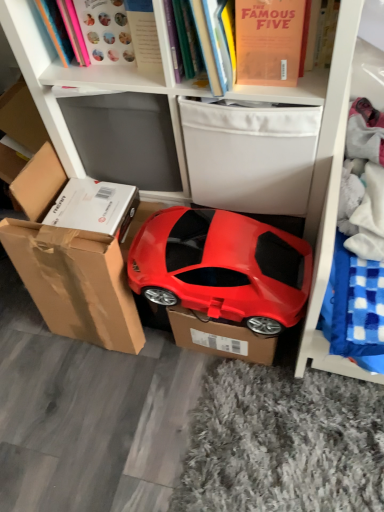
What do you see at coordinates (56, 29) in the screenshot? This screenshot has width=384, height=512. I see `matte pink book at upper left, which appears as the third book when viewed from the right` at bounding box center [56, 29].

In order to face matte pink book at upper left, the 1th book when ordered from left to right, should I rotate leftwards or rightwards?

Rotate left and turn 17.735 degrees.

In order to click on brown cardboard box at lower left in this screenshot , I will do `click(70, 265)`.

Describe the element at coordinates (102, 31) in the screenshot. Image resolution: width=384 pixels, height=512 pixels. I see `hardcover book at upper center, the 2th book in the left-to-right sequence` at that location.

This screenshot has width=384, height=512. In order to click on matte pink book at upper left, the 1th book when ordered from left to right in this screenshot , I will do `click(56, 29)`.

Which of these two, matte pink book at upper left, the 1th book when ordered from left to right, or hardcover book at upper center, which is the second book in right-to-left order, is wider?

Wider between the two is hardcover book at upper center, which is the second book in right-to-left order.

Does matte pink book at upper left, the 1th book when ordered from left to right, appear on the right side of hardcover book at upper center, which is the second book in right-to-left order?

No, matte pink book at upper left, the 1th book when ordered from left to right, is not to the right of hardcover book at upper center, which is the second book in right-to-left order.

Is matte pink book at upper left, the 1th book when ordered from left to right, in front of or behind hardcover book at upper center, the 2th book in the left-to-right sequence, in the image?

Visually, matte pink book at upper left, the 1th book when ordered from left to right, is located behind hardcover book at upper center, the 2th book in the left-to-right sequence.

Is matte pink book at upper left, which appears as the third book when viewed from the right, turned away from hardcover book at upper center, the 2th book in the left-to-right sequence?

No.

Is point (46, 14) closer to camera compared to point (102, 247)?

No, (46, 14) is behind (102, 247).

Does hardcover book at upper center, which is the second book in right-to-left order, turn towards brown cardboard box at lower left?

No, hardcover book at upper center, which is the second book in right-to-left order, is not aimed at brown cardboard box at lower left.

Consider the image. Which of these two, hardcover book at upper center, which is the second book in right-to-left order, or brown cardboard box at lower left, is thinner?

Thinner between the two is brown cardboard box at lower left.

Measure the distance from hardcover book at upper center, the 2th book in the left-to-right sequence, to brown cardboard box at lower left.

hardcover book at upper center, the 2th book in the left-to-right sequence, is 20.40 inches away from brown cardboard box at lower left.

From the image's perspective, which book is the 3rd one above the glossy plastic car at center? Please provide its 2D coordinates.

[(56, 29)]

Does glossy plastic car at center appear on the left side of matte pink book at upper left, which appears as the third book when viewed from the right?

In fact, glossy plastic car at center is to the right of matte pink book at upper left, which appears as the third book when viewed from the right.

Does glossy plastic car at center come behind matte pink book at upper left, which appears as the third book when viewed from the right?

That is True.

From a real-world perspective, is white fabric storage box at upper center positioned over glossy plastic car at center based on gravity?

Yes, from a real-world perspective, white fabric storage box at upper center is on top of glossy plastic car at center.

Looking at this image, is white fabric storage box at upper center closer to camera compared to glossy plastic car at center?

No, the depth of white fabric storage box at upper center is greater than that of glossy plastic car at center.

Is white fabric storage box at upper center spatially inside glossy plastic car at center, or outside of it?

white fabric storage box at upper center lies outside glossy plastic car at center.

What's the angular difference between matte pink book at upper left, which appears as the third book when viewed from the right, and white fabric storage box at upper center's facing directions?

matte pink book at upper left, which appears as the third book when viewed from the right, and white fabric storage box at upper center are facing 6.11 degrees away from each other.

Considering the sizes of matte pink book at upper left, which appears as the third book when viewed from the right, and white fabric storage box at upper center in the image, is matte pink book at upper left, which appears as the third book when viewed from the right, taller or shorter than white fabric storage box at upper center?

In the image, matte pink book at upper left, which appears as the third book when viewed from the right, appears to be shorter than white fabric storage box at upper center.

Is point (48, 27) more distant than point (245, 188)?

No, it is not.

In order to click on box on the left of hardcover book at upper center, the 2th book in the left-to-right sequence in this screenshot , I will do `click(70, 265)`.

Measure the distance between brown cardboard box at lower left and hardcover book at upper center, which is the second book in right-to-left order.

brown cardboard box at lower left and hardcover book at upper center, which is the second book in right-to-left order, are 20.40 inches apart from each other.

Can we say brown cardboard box at lower left lies outside hardcover book at upper center, the 2th book in the left-to-right sequence?

Absolutely, brown cardboard box at lower left is external to hardcover book at upper center, the 2th book in the left-to-right sequence.

In the scene shown: Who is taller, brown cardboard box at lower left or hardcover book at upper center, the 2th book in the left-to-right sequence?

Standing taller between the two is brown cardboard box at lower left.

Is brown cardboard box at lower left to the right of white fabric storage box at upper center from the viewer's perspective?

No.

From the image's perspective, between brown cardboard box at lower left and white fabric storage box at upper center, which one is located above?

white fabric storage box at upper center.

Is brown cardboard box at lower left shorter than white fabric storage box at upper center?

In fact, brown cardboard box at lower left may be taller than white fabric storage box at upper center.

How different are the orientations of brown cardboard box at lower left and white fabric storage box at upper center in degrees?

4.06 degrees separate the facing orientations of brown cardboard box at lower left and white fabric storage box at upper center.

In order to click on book on the left of the hardcover book at upper center, which is the second book in right-to-left order in this screenshot , I will do `click(56, 29)`.

In order to click on box below the hardcover book at upper center, which is the second book in right-to-left order (from the image's perspective) in this screenshot , I will do `click(70, 265)`.

Looking at the image, which one is located further to glossy plastic car at center, matte orange book at upper center, the 1th book positioned from the right, or brown cardboard box at lower left?

matte orange book at upper center, the 1th book positioned from the right, lies further to glossy plastic car at center than the other object.

Which object lies further to the anchor point matte pink book at upper left, the 1th book when ordered from left to right, hardcover book at upper center, the 2th book in the left-to-right sequence, or matte orange book at upper center, which is the 3th book from left to right?

matte orange book at upper center, which is the 3th book from left to right.

From the image, which object appears to be nearer to brown cardboard box at lower left, matte pink book at upper left, which appears as the third book when viewed from the right, or glossy plastic car at center?

Based on the image, glossy plastic car at center appears to be nearer to brown cardboard box at lower left.

From the picture: Which object lies further to the anchor point matte pink book at upper left, which appears as the third book when viewed from the right, white fabric storage box at upper center or glossy plastic car at center?

glossy plastic car at center is further to matte pink book at upper left, which appears as the third book when viewed from the right.

From the image, which object appears to be farther from matte pink book at upper left, which appears as the third book when viewed from the right, glossy plastic car at center or matte orange book at upper center, the 1th book positioned from the right?

Based on the image, glossy plastic car at center appears to be further to matte pink book at upper left, which appears as the third book when viewed from the right.

From the picture: Considering their positions, is matte orange book at upper center, the 1th book positioned from the right, positioned further to glossy plastic car at center than white fabric storage box at upper center?

The object further to glossy plastic car at center is matte orange book at upper center, the 1th book positioned from the right.

From the image, which object appears to be nearer to matte orange book at upper center, the 1th book positioned from the right, matte pink book at upper left, which appears as the third book when viewed from the right, or hardcover book at upper center, which is the second book in right-to-left order?

hardcover book at upper center, which is the second book in right-to-left order, is closer to matte orange book at upper center, the 1th book positioned from the right.

Based on their spatial positions, is brown cardboard box at lower left or matte pink book at upper left, which appears as the third book when viewed from the right, closer to hardcover book at upper center, which is the second book in right-to-left order?

matte pink book at upper left, which appears as the third book when viewed from the right.

Where is `storage box between hardcover book at upper center, the 2th book in the left-to-right sequence, and glossy plastic car at center in the up-down direction`? The width and height of the screenshot is (384, 512). storage box between hardcover book at upper center, the 2th book in the left-to-right sequence, and glossy plastic car at center in the up-down direction is located at coordinates (250, 155).

At what (x,y) coordinates should I click in order to perform the action: click on car situated between brown cardboard box at lower left and white fabric storage box at upper center from left to right. Please return your answer as a coordinate pair (x, y). Image resolution: width=384 pixels, height=512 pixels. Looking at the image, I should click on (221, 266).

Locate an element on the screen. storage box between hardcover book at upper center, which is the second book in right-to-left order, and brown cardboard box at lower left from top to bottom is located at coordinates (250, 155).

What are the coordinates of `storage box between matte pink book at upper left, which appears as the third book when viewed from the right, and brown cardboard box at lower left vertically` in the screenshot? It's located at (250, 155).